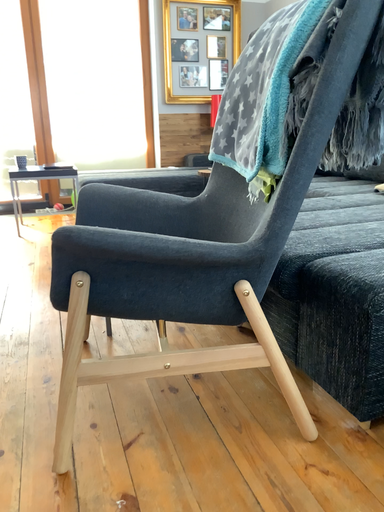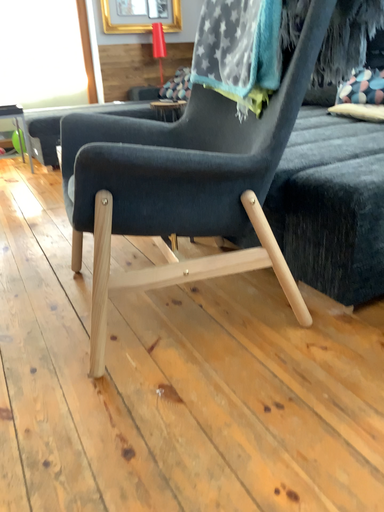
Question: Which way did the camera rotate in the video?

Choices:
 (A) rotated right
 (B) rotated left

Answer: (A)